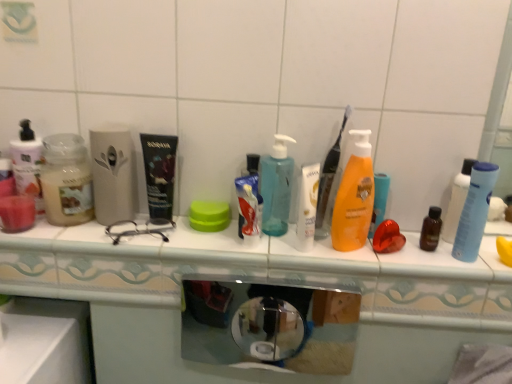
Find the location of `vacant space in front of dark blue plastic tube at center`. vacant space in front of dark blue plastic tube at center is located at coordinates (154, 242).